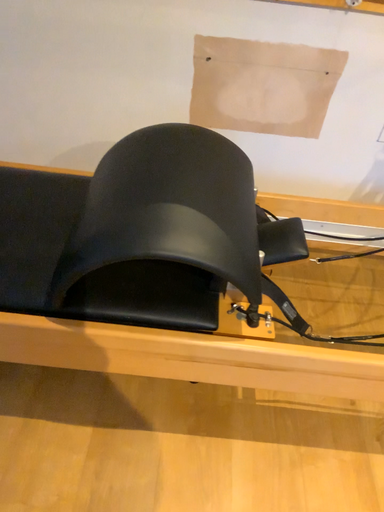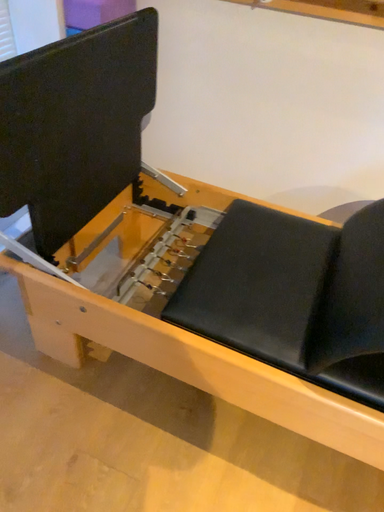
Question: Which way did the camera rotate in the video?

Choices:
 (A) rotated right
 (B) rotated left

Answer: (B)